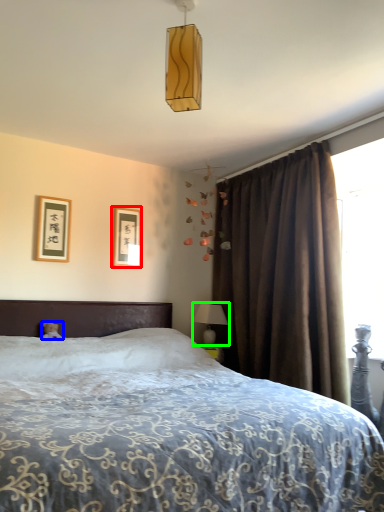
Question: Which object is positioned farthest from picture frame (highlighted by a red box)? Select from teddy bear (highlighted by a blue box) and table lamp (highlighted by a green box).

Choices:
 (A) teddy bear
 (B) table lamp

Answer: (A)